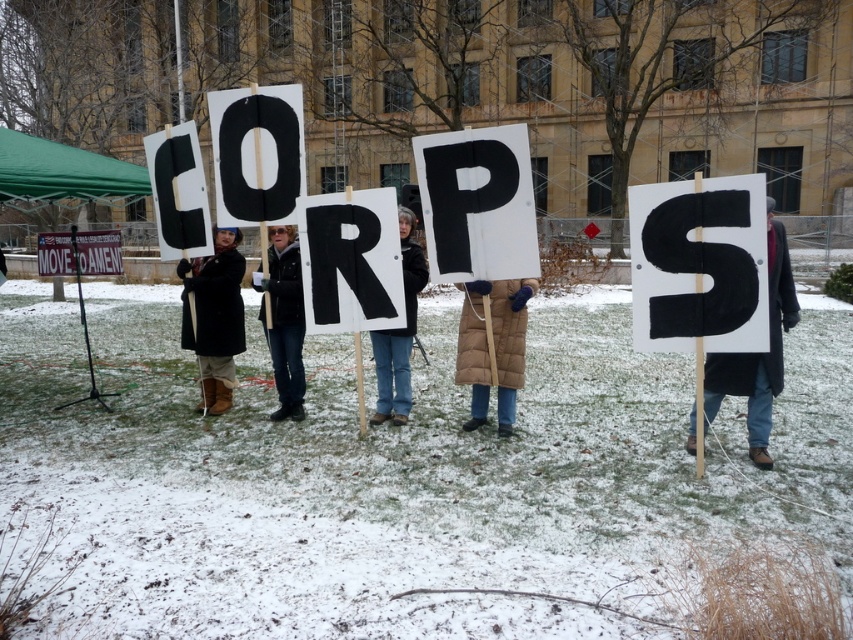
Question: Which point is closer to the camera taking this photo?

Choices:
 (A) (225, 400)
 (B) (287, 93)
 (C) (334, 227)
 (D) (640, 300)

Answer: (D)

Question: Which object is positioned farthest from the black leather jacket at center?

Choices:
 (A) black cardboard letter c at upper center
 (B) dark brown leather boots at center

Answer: (A)

Question: Does black cardboard letter o at center come behind dark brown leather boots at center?

Choices:
 (A) no
 (B) yes

Answer: (A)

Question: Which point is closer to the camera taking this photo?

Choices:
 (A) (210, 378)
 (B) (234, 205)

Answer: (B)

Question: Is black felt letter s at right further to the viewer compared to black cardboard letter o at center?

Choices:
 (A) no
 (B) yes

Answer: (A)

Question: From the image, what is the correct spatial relationship of black felt letter s at right in relation to black leather jacket at center?

Choices:
 (A) right
 (B) left

Answer: (A)